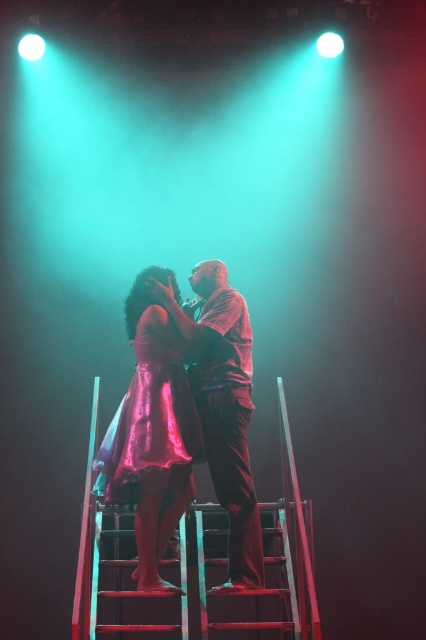
Question: Which point is farther to the camera?

Choices:
 (A) shiny pink dress at center
 (B) matte brown shirt at center

Answer: (B)

Question: Can you confirm if matte brown shirt at center is positioned to the right of shiny pink dress at center?

Choices:
 (A) no
 (B) yes

Answer: (B)

Question: Observing the image, what is the correct spatial positioning of matte brown shirt at center in reference to shiny pink dress at center?

Choices:
 (A) below
 (B) above

Answer: (B)

Question: Which point is farther to the camera?

Choices:
 (A) tap(150, 454)
 (B) tap(206, 276)

Answer: (B)

Question: Which of the following is the farthest from the observer?

Choices:
 (A) matte brown shirt at center
 (B) shiny pink dress at center

Answer: (A)

Question: Can you confirm if matte brown shirt at center is positioned to the right of shiny pink dress at center?

Choices:
 (A) no
 (B) yes

Answer: (B)